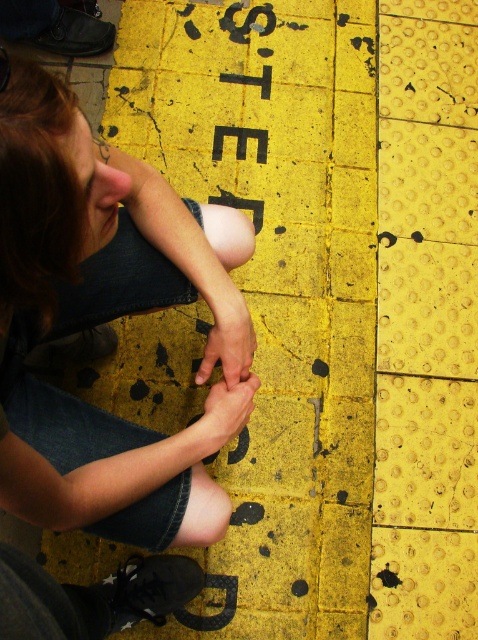
You are a visually impaired person trying to read the black rubber letters at center. Can you feel the smooth skin hand at center while touching the letters?

The black rubber letters at center are to the right of the smooth skin hand at center, so you can feel the smooth skin hand at center while touching the letters.

You are a visually impaired person trying to navigate using the tactile paving. You feel a raised object at point (247,20). What is it?

The raised object at point (247,20) is black rubber letters at center.